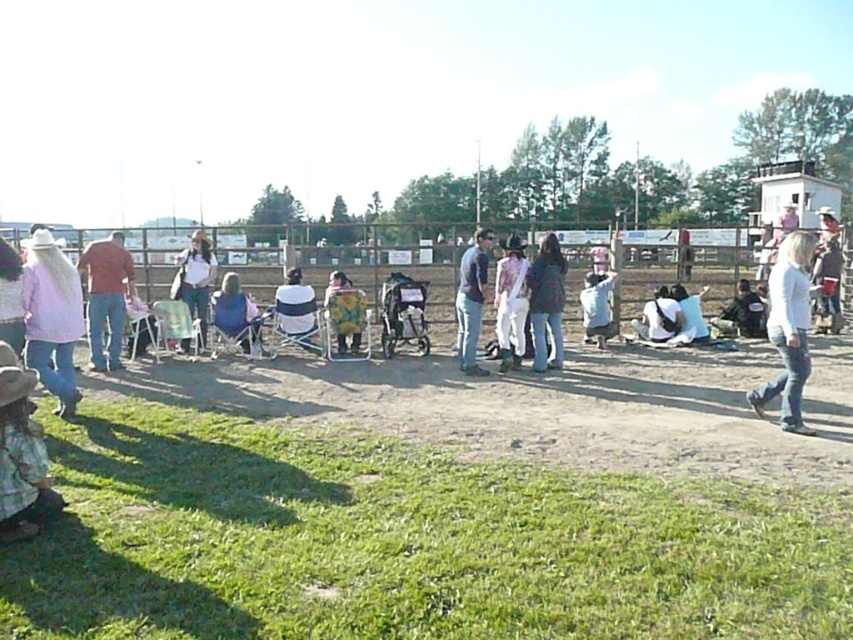
In the scene shown: You are a photographer at the event and need to capture both the pastel pink sweater at left and the checkered fabric shirt at lower left in a single frame. Which clothing item should you focus on to ensure both are clearly visible?

The pastel pink sweater at left is larger in size than the checkered fabric shirt at lower left, so focusing on the pastel pink sweater at left would help ensure both are clearly visible in the frame.

You are a photographer trying to capture a candid shot of the blue denim jeans at center without including the checkered fabric shirt at lower left in the frame. Based on their positions, is this possible?

The checkered fabric shirt at lower left is in front of the blue denim jeans at center, so it would block the view. Therefore, capturing the blue denim jeans at center without the checkered fabric shirt at lower left in the frame is not possible.

You are a photographer at the event and want to capture both the pastel pink sweater at left and the light blue denim shirt at center in a single frame. Which clothing item should you focus on first to ensure both are in the shot?

The pastel pink sweater at left is smaller than the light blue denim shirt at center, so you should focus on the light blue denim shirt at center first to ensure both are in the shot.